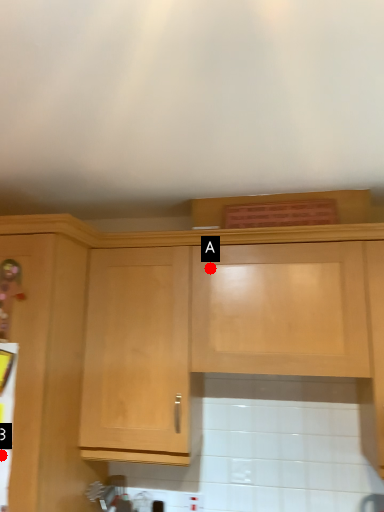
Question: Two points are circled on the image, labeled by A and B beside each circle. Which point is closer to the camera taking this photo?

Choices:
 (A) A is closer
 (B) B is closer

Answer: (B)